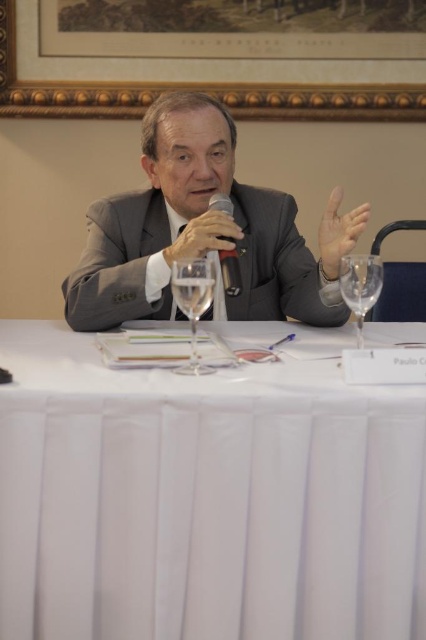
Does gray suit at center appear over matte gray hand at upper right?

No.

Does gray suit at center lie in front of matte gray hand at upper right?

No, gray suit at center is behind matte gray hand at upper right.

Who is more forward, (204, 188) or (328, 260)?

Positioned in front is point (328, 260).

Identify the location of gray suit at center. (203, 230).

Where is `clear glass wine glass at center`? clear glass wine glass at center is located at coordinates (192, 301).

Does clear glass wine glass at center have a smaller size compared to matte black microphone at center?

Indeed, clear glass wine glass at center has a smaller size compared to matte black microphone at center.

Image resolution: width=426 pixels, height=640 pixels. I want to click on clear glass wine glass at center, so click(x=192, y=301).

Who is taller, white cloth at center or matte black microphone at center?

white cloth at center

From the picture: Between white cloth at center and matte black microphone at center, which one is positioned lower?

white cloth at center is below.

Is point (252, 538) farther from camera compared to point (204, 220)?

No, (252, 538) is closer to viewer.

Identify the location of white cloth at center. (204, 499).